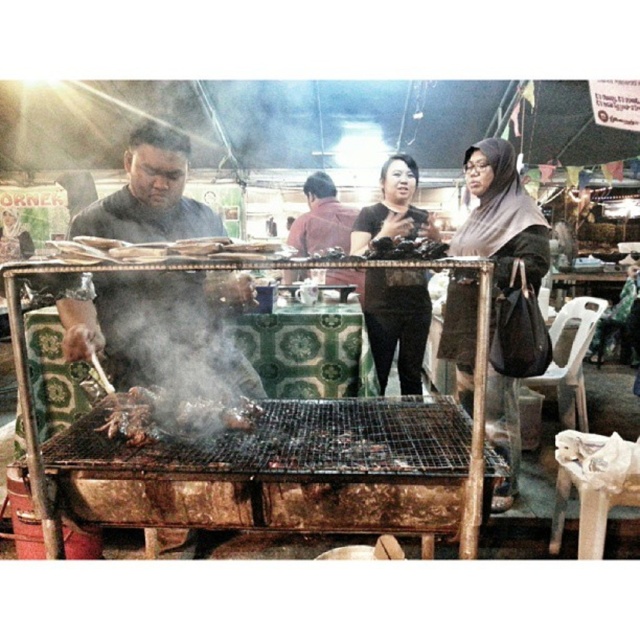
Question: From the image, what is the correct spatial relationship of matte black shirt at center in relation to dark red shirt at center?

Choices:
 (A) left
 (B) right

Answer: (B)

Question: Does brown fabric hijab at center have a lesser width compared to charred meat at center?

Choices:
 (A) yes
 (B) no

Answer: (B)

Question: Is dark red shirt at center thinner than charred meat at center?

Choices:
 (A) yes
 (B) no

Answer: (B)

Question: Which is farther from the brown fabric hijab at center?

Choices:
 (A) dark red shirt at center
 (B) charred meat at center
 (C) charcoal-grilled chicken at center

Answer: (B)

Question: Among these objects, which one is nearest to the camera?

Choices:
 (A) charred meat at center
 (B) matte black shirt at center
 (C) brown fabric hijab at center
 (D) charcoal-grilled chicken at center

Answer: (A)

Question: Which object is the closest to the charcoal-grilled chicken at center?

Choices:
 (A) brown fabric hijab at center
 (B) dark red shirt at center

Answer: (A)